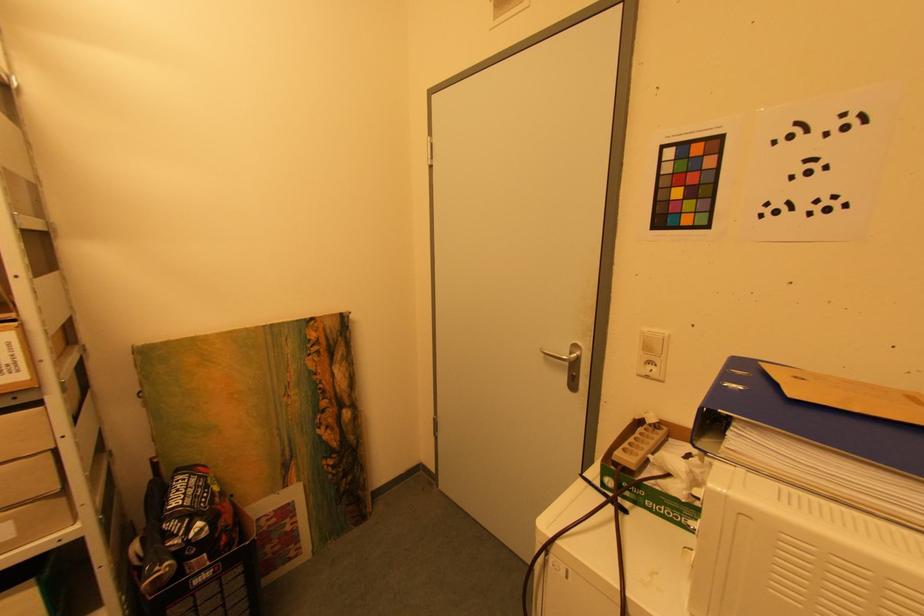
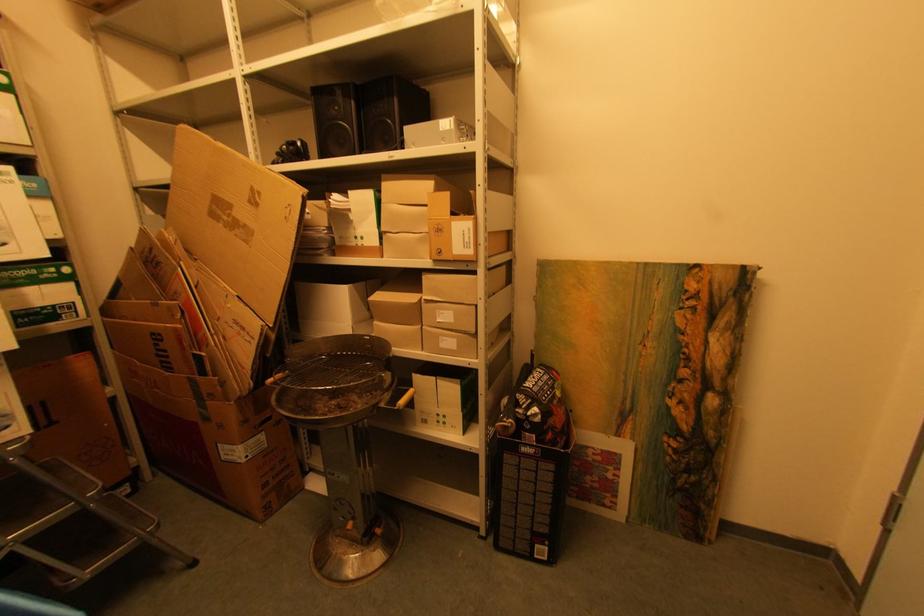
Question: Based on the continuous images, in which direction is the camera rotating? Reply with the corresponding letter.

Choices:
 (A) Left
 (B) Right
 (C) Up
 (D) Down

Answer: (A)